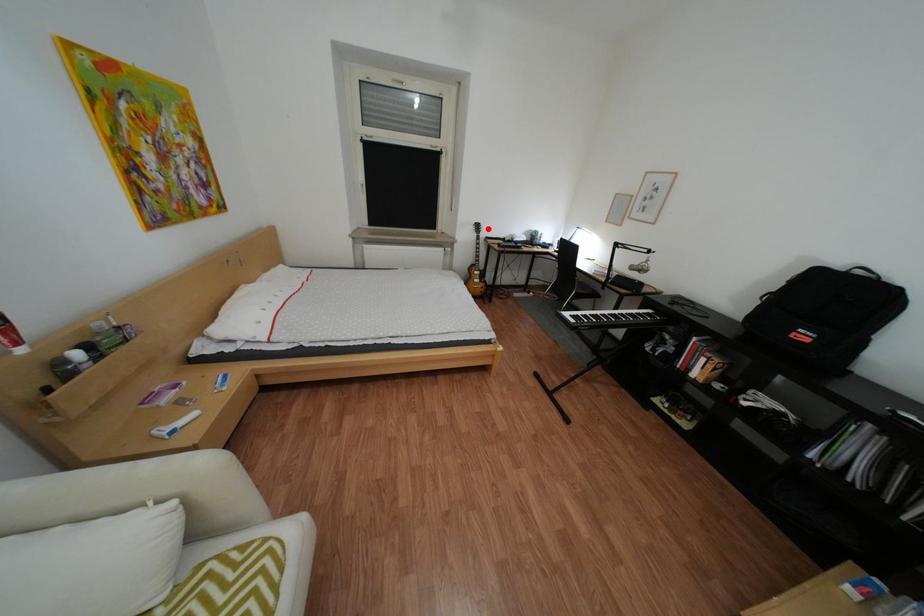
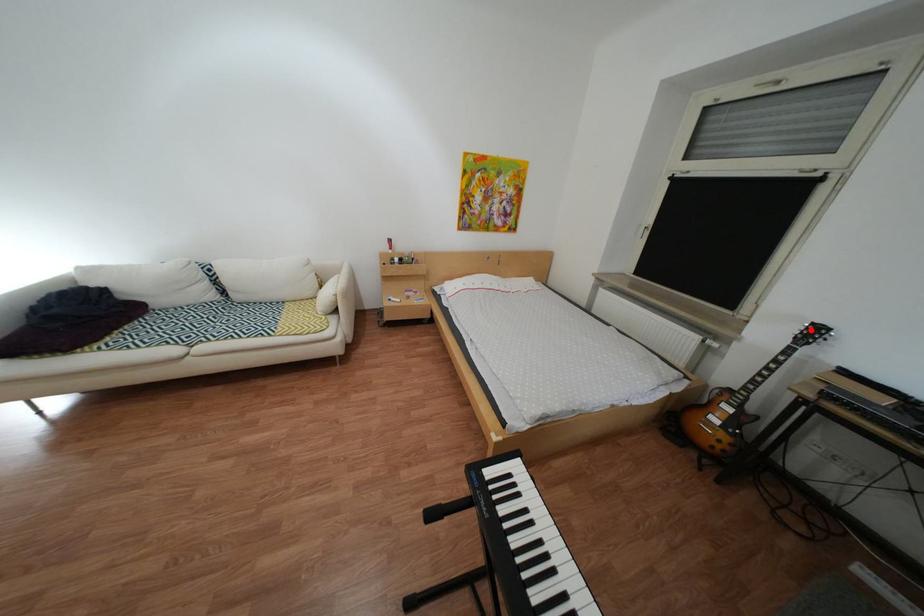
I am providing you with two images of the same scene from different viewpoints. A red point is marked on the first image and another point is marked on the second image. Is the marked point in image1 the same physical position as the marked point in image2?

Yes